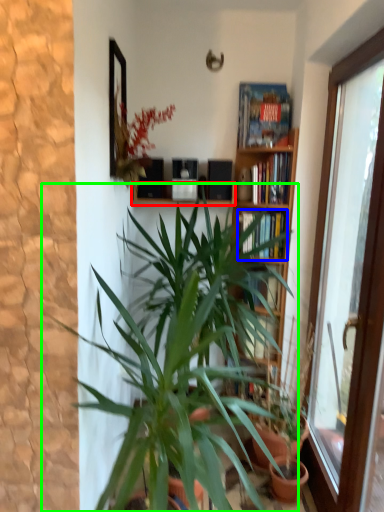
Question: Estimate the real-world distances between objects in this image. Which object is closer to window sill (highlighted by a red box), book (highlighted by a blue box) or houseplant (highlighted by a green box)?

Choices:
 (A) book
 (B) houseplant

Answer: (A)